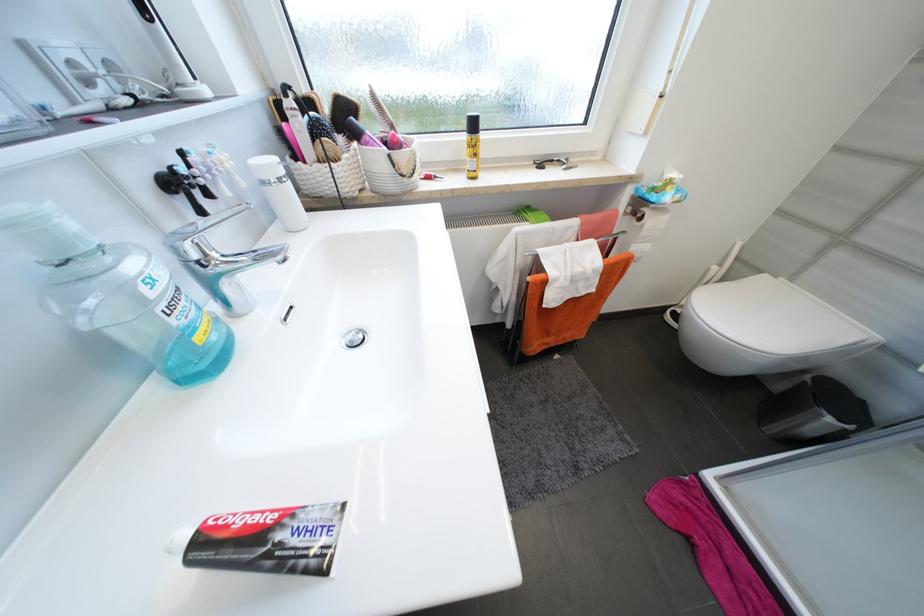
The width and height of the screenshot is (924, 616). I want to click on black hairbrush, so click(x=178, y=188).